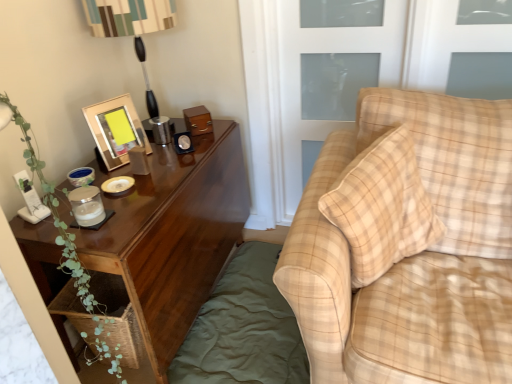
Question: Does green leafy plant at left appear on the left side of woodenobject at upper left?

Choices:
 (A) yes
 (B) no

Answer: (B)

Question: Can you confirm if green leafy plant at left is thinner than woodenobject at upper left?

Choices:
 (A) no
 (B) yes

Answer: (A)

Question: Does green leafy plant at left contain woodenobject at upper left?

Choices:
 (A) yes
 (B) no

Answer: (B)

Question: Considering the relative sizes of green leafy plant at left and woodenobject at upper left in the image provided, is green leafy plant at left taller than woodenobject at upper left?

Choices:
 (A) no
 (B) yes

Answer: (B)

Question: From the image's perspective, is green leafy plant at left located beneath woodenobject at upper left?

Choices:
 (A) no
 (B) yes

Answer: (B)

Question: Can we say green leafy plant at left lies outside woodenobject at upper left?

Choices:
 (A) yes
 (B) no

Answer: (A)

Question: Does shiny brown wood nightstand at left have a smaller size compared to plaid fabric couch at right?

Choices:
 (A) no
 (B) yes

Answer: (B)

Question: Does shiny brown wood nightstand at left have a lesser height compared to plaid fabric couch at right?

Choices:
 (A) yes
 (B) no

Answer: (A)

Question: Does shiny brown wood nightstand at left have a greater height compared to plaid fabric couch at right?

Choices:
 (A) yes
 (B) no

Answer: (B)

Question: Would you consider shiny brown wood nightstand at left to be distant from plaid fabric couch at right?

Choices:
 (A) yes
 (B) no

Answer: (B)

Question: From the image's perspective, is shiny brown wood nightstand at left under plaid fabric couch at right?

Choices:
 (A) yes
 (B) no

Answer: (A)

Question: Is shiny brown wood nightstand at left closer to the viewer compared to plaid fabric couch at right?

Choices:
 (A) yes
 (B) no

Answer: (B)

Question: Is wooden table lamp at upper left positioned behind green cotton bedding at lower left?

Choices:
 (A) no
 (B) yes

Answer: (B)